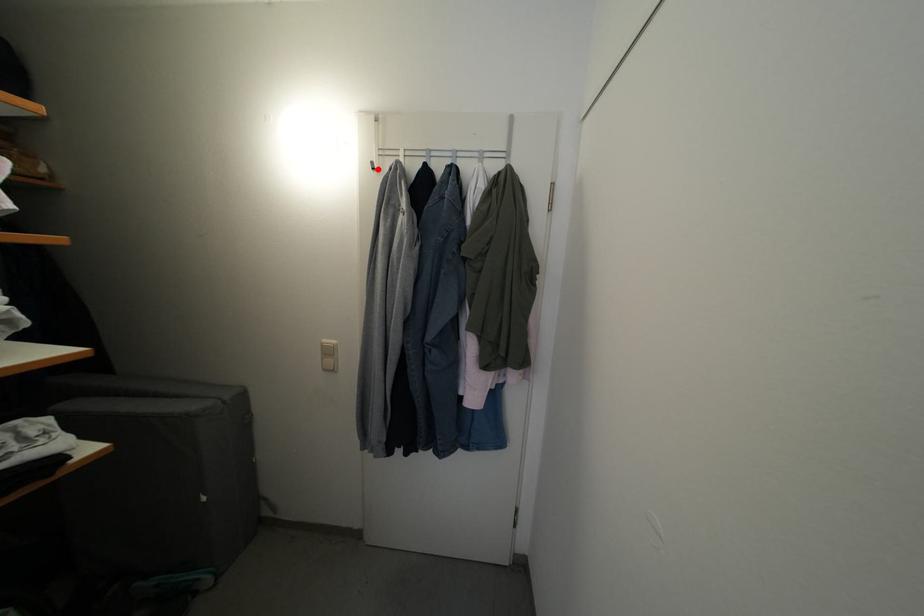
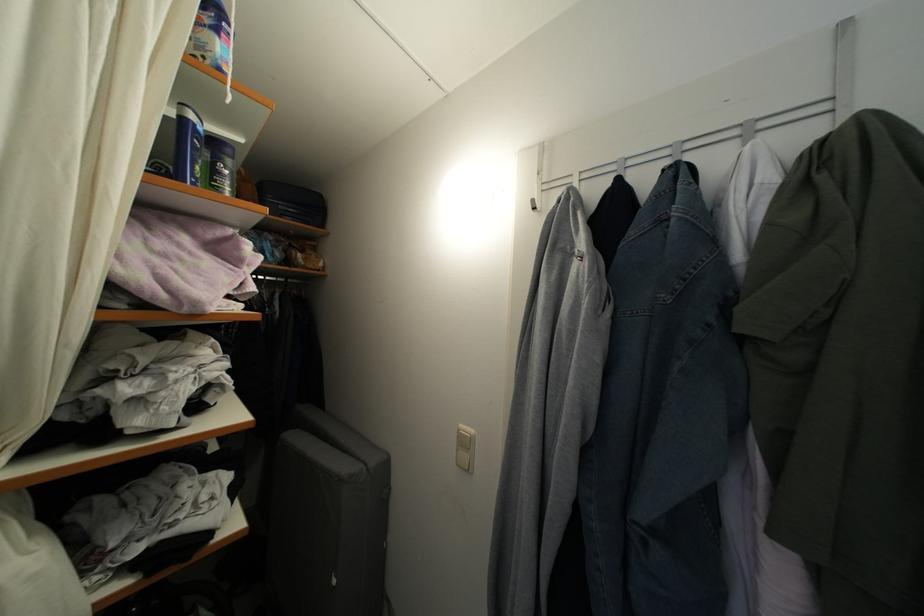
In the second image, find the point that corresponds to the highlighted location in the first image.

(538, 207)